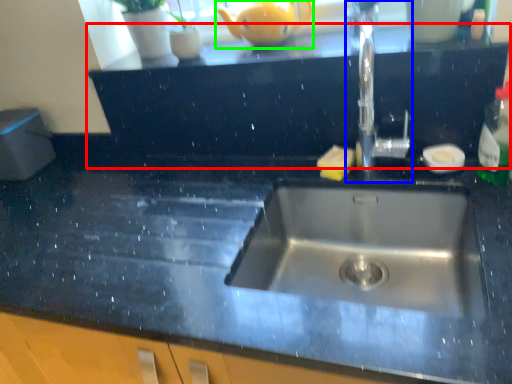
Question: Considering the real-world distances, which object is farthest from dresser (highlighted by a red box)? tap (highlighted by a blue box) or tea pot (highlighted by a green box)?

Choices:
 (A) tap
 (B) tea pot

Answer: (B)